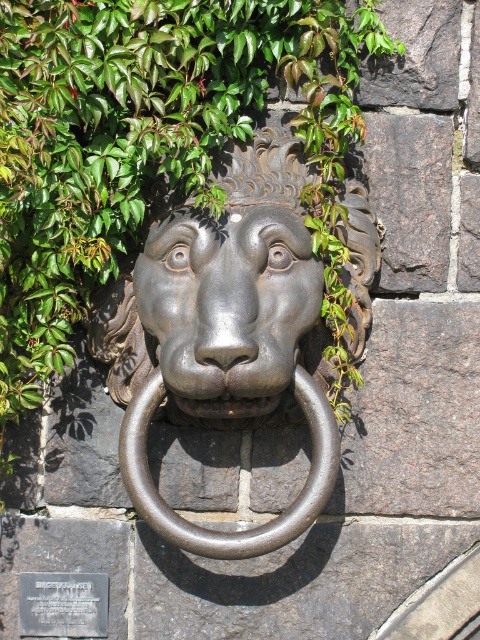
Which is behind, point (195, 275) or point (33, 589)?

Point (33, 589)

Who is positioned more to the left, bronze metallic lion head at center or silver metallic plaque at lower left?

From the viewer's perspective, silver metallic plaque at lower left appears more on the left side.

Where is `bronze metallic lion head at center`? This screenshot has width=480, height=640. bronze metallic lion head at center is located at coordinates (224, 337).

The image size is (480, 640). I want to click on bronze metallic lion head at center, so click(x=224, y=337).

Measure the distance between green leafy plant at center and matte bronze lion head at center.

7.67 inches

Is green leafy plant at center shorter than matte bronze lion head at center?

Incorrect, green leafy plant at center's height does not fall short of matte bronze lion head at center's.

Between point (256, 8) and point (252, 252), which one is positioned behind?

The point (256, 8) is behind.

You are a GUI agent. You are given a task and a screenshot of the screen. Output one action in this format:
    pyautogui.click(x=<x>, y=<y>)
    Task: Click on the green leafy plant at center
    The height and width of the screenshot is (640, 480).
    Given the screenshot: What is the action you would take?
    pyautogui.click(x=154, y=147)

Looking at this image, which is more to the right, green leafy plant at center or silver metallic plaque at lower left?

Positioned to the right is green leafy plant at center.

Can you confirm if green leafy plant at center is positioned above silver metallic plaque at lower left?

Correct, green leafy plant at center is located above silver metallic plaque at lower left.

The height and width of the screenshot is (640, 480). In order to click on green leafy plant at center in this screenshot , I will do `click(154, 147)`.

Identify the location of green leafy plant at center. The image size is (480, 640). (154, 147).